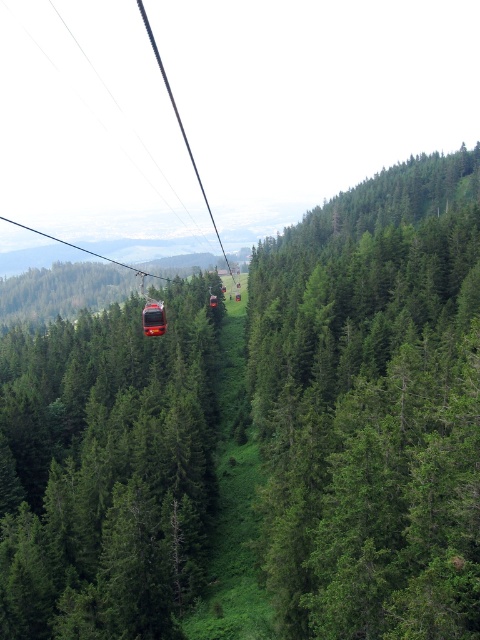
Does green matte tree at center have a smaller size compared to metallic cable car at center?

Actually, green matte tree at center might be larger than metallic cable car at center.

Can you confirm if green matte tree at center is positioned above metallic cable car at center?

No, green matte tree at center is not above metallic cable car at center.

Is point (81, 506) farther from camera compared to point (160, 314)?

No.

The image size is (480, 640). In order to click on green matte tree at center in this screenshot , I will do `click(107, 470)`.

Is green leafy tree at center smaller than metallic cable car at center?

No, green leafy tree at center is not smaller than metallic cable car at center.

Is green leafy tree at center to the right of metallic cable car at center from the viewer's perspective?

Correct, you'll find green leafy tree at center to the right of metallic cable car at center.

From the picture: Who is more distant from viewer, (477, 579) or (148, 317)?

Positioned behind is point (148, 317).

Where is `green leafy tree at center`? The image size is (480, 640). green leafy tree at center is located at coordinates (372, 406).

Between green leafy tree at center and green matte tree at center, which one is positioned higher?

green leafy tree at center is above.

Based on the photo, does green leafy tree at center have a smaller size compared to green matte tree at center?

No, green leafy tree at center is not smaller than green matte tree at center.

Is point (345, 355) closer to camera compared to point (156, 467)?

No.

Find the location of a particular element. green leafy tree at center is located at coordinates (372, 406).